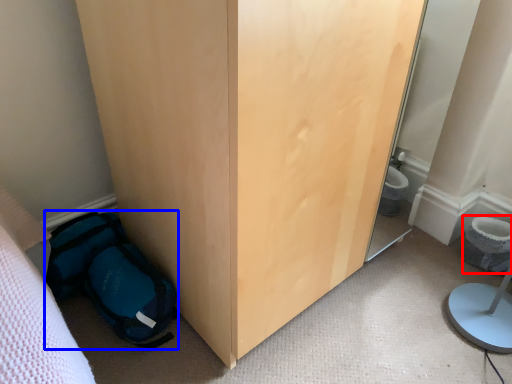
Question: Which of the following is the farthest to the observer, toilet bowl (highlighted by a red box) or backpack (highlighted by a blue box)?

Choices:
 (A) toilet bowl
 (B) backpack

Answer: (A)